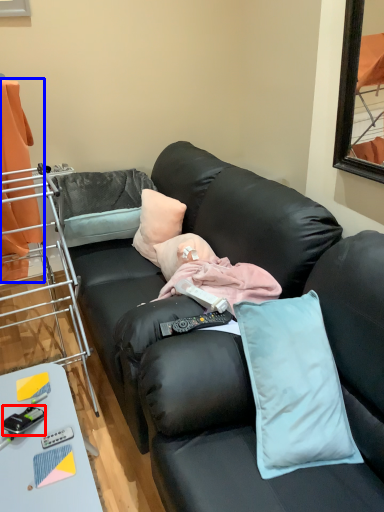
Question: Which point is closer to the camera, equipment (highlighted by a red box) or curtain (highlighted by a blue box)?

Choices:
 (A) equipment
 (B) curtain

Answer: (A)